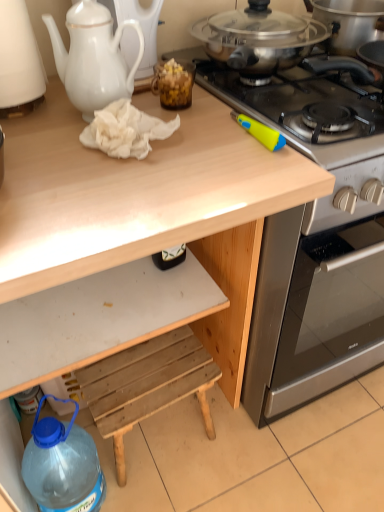
You are a GUI agent. You are given a task and a screenshot of the screen. Output one action in this format:
    pyautogui.click(x=<x>, y=<y>)
    Task: Click on the free space to the right of wooden step stool at lower center
    Image resolution: width=384 pixels, height=512 pixels.
    Given the screenshot: What is the action you would take?
    pyautogui.click(x=238, y=455)